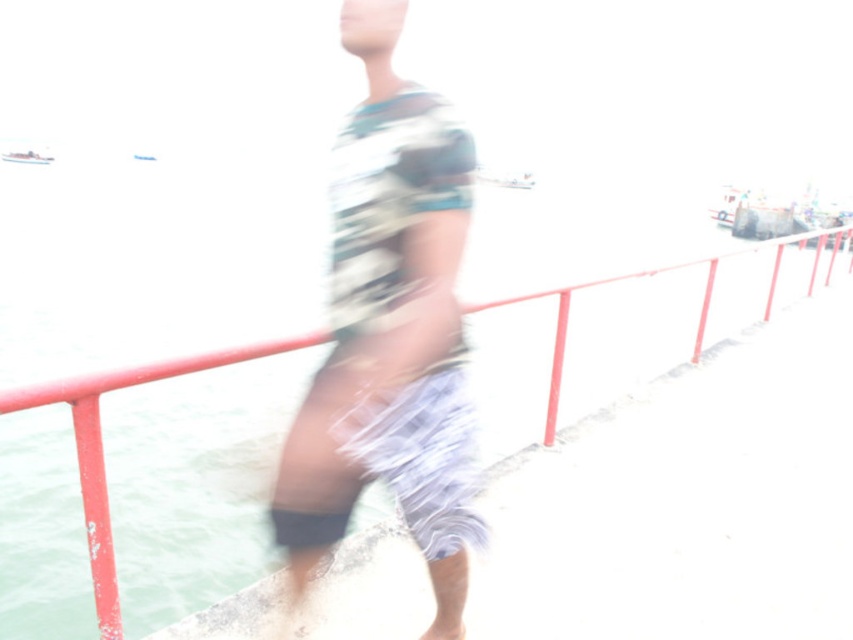
You are a photographer trying to capture a clear photo of the red metal railing at center and the white plastic boat at left. Since the scene is overexposed, you decide to adjust your camera settings to focus on the narrower object. Which object should you focus on?

The white plastic boat at left is narrower than the red metal railing at center, so you should focus on the white plastic boat at left to capture a clear photo.

You are standing on the dock and see the camouflage fabric shirt at center and the white plastic boat at left. Which object is closer to you?

The camouflage fabric shirt at center is closer to you because it is in front of the white plastic boat at left.